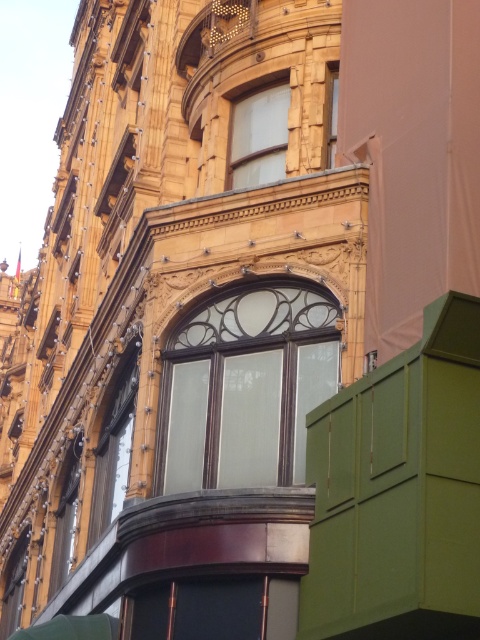
You are an architect inspecting the building facade. You notice the matte glass window at upper left and the clear glass window at upper center. Which window is located higher on the building facade?

The clear glass window at upper center is higher because the matte glass window at upper left is positioned under it.

You are an architect examining the building facade. You need to determine if the matte glass window at upper left can accommodate a wider decorative frame than the clear glass window at upper center. Can it?

The matte glass window at upper left might be wider than clear glass window at upper center, so it could potentially accommodate a wider decorative frame than the clear glass window at upper center.